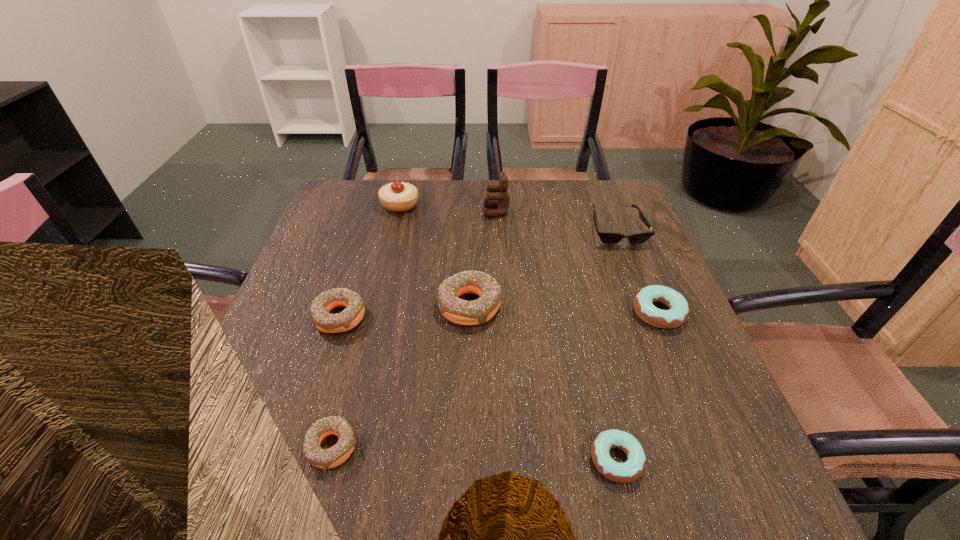
What are the coordinates of `teddy bear` in the screenshot? It's located at (501, 200).

Where is `beige pastry`? The height and width of the screenshot is (540, 960). beige pastry is located at coordinates (397, 197).

Locate an element on the screen. the second tallest object is located at coordinates (397, 197).

Where is `the sixth shortest object`? the sixth shortest object is located at coordinates (459, 311).

What are the coordinates of `the biggest chocolate doughnut` in the screenshot? It's located at (459, 311).

The height and width of the screenshot is (540, 960). I want to click on sunglasses, so click(x=606, y=237).

Find the location of a particular element. This screenshot has height=540, width=960. the second smallest chocolate doughnut is located at coordinates (351, 316).

At what (x,y) coordinates should I click in order to perform the action: click on the rightmost doughnut. Please return your answer as a coordinate pair (x, y). Looking at the image, I should click on (678, 312).

This screenshot has width=960, height=540. I want to click on the right blue doughnut, so click(678, 312).

Find the location of a particular element. Image resolution: width=960 pixels, height=540 pixels. the smallest chocolate doughnut is located at coordinates (332, 457).